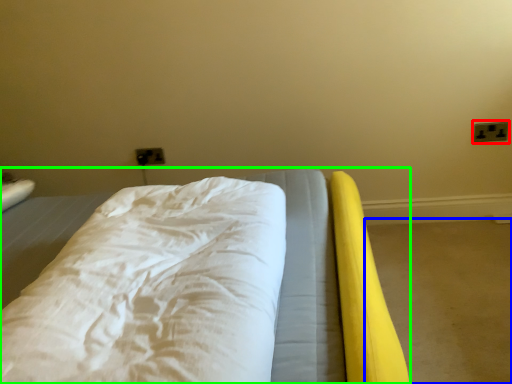
Question: Which object is positioned farthest from electric outlet (highlighted by a red box)? Select from concrete (highlighted by a blue box) and bed (highlighted by a green box).

Choices:
 (A) concrete
 (B) bed

Answer: (B)